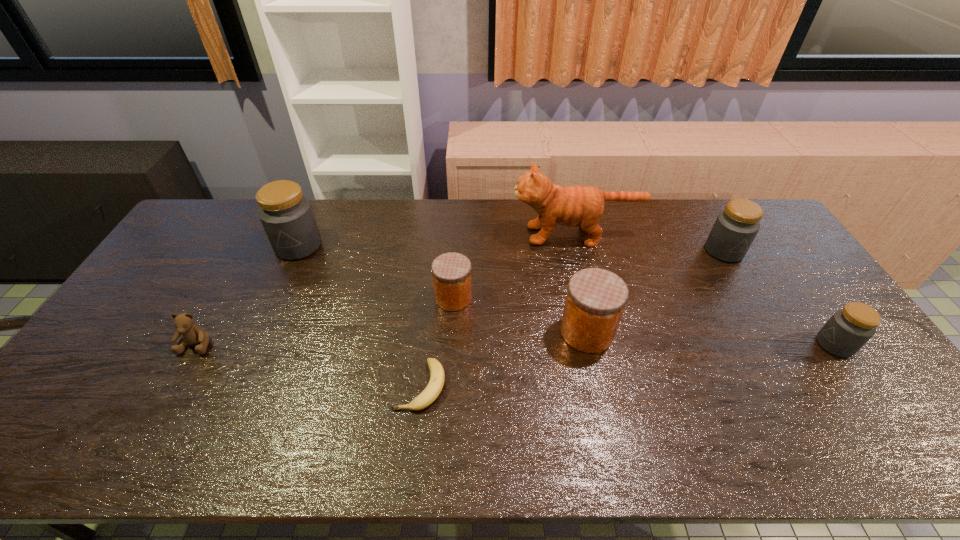
Where is `the smallest gray jar`? the smallest gray jar is located at coordinates (844, 334).

The height and width of the screenshot is (540, 960). What are the coordinates of `the nearest gray jar` in the screenshot? It's located at (844, 334).

You are a GUI agent. You are given a task and a screenshot of the screen. Output one action in this format:
    pyautogui.click(x=<x>, y=<y>)
    Task: Click on the seventh tallest object
    This screenshot has width=960, height=540.
    Given the screenshot: What is the action you would take?
    pyautogui.click(x=192, y=334)

What are the coordinates of `brown teddy bear` in the screenshot? It's located at (192, 334).

The width and height of the screenshot is (960, 540). I want to click on the shortest object, so click(x=431, y=392).

What are the coordinates of `banana` in the screenshot? It's located at (431, 392).

At what (x,y) coordinates should I click in order to perform the action: click on vacant space located 0.230m on the face of the tallest object. Please return your answer as a coordinate pair (x, y). The width and height of the screenshot is (960, 540). Looking at the image, I should click on (445, 235).

At what (x,y) coordinates should I click in order to perform the action: click on vacant area situated on the face of the tallest object. Please return your answer as a coordinate pair (x, y). The height and width of the screenshot is (540, 960). Looking at the image, I should click on [x=408, y=235].

Identify the location of free space located 0.240m on the face of the tallest object. This screenshot has width=960, height=540. (443, 235).

In order to click on free space located 0.300m on the surface of the second object from left to right near the warning symbol in this screenshot , I will do `click(258, 335)`.